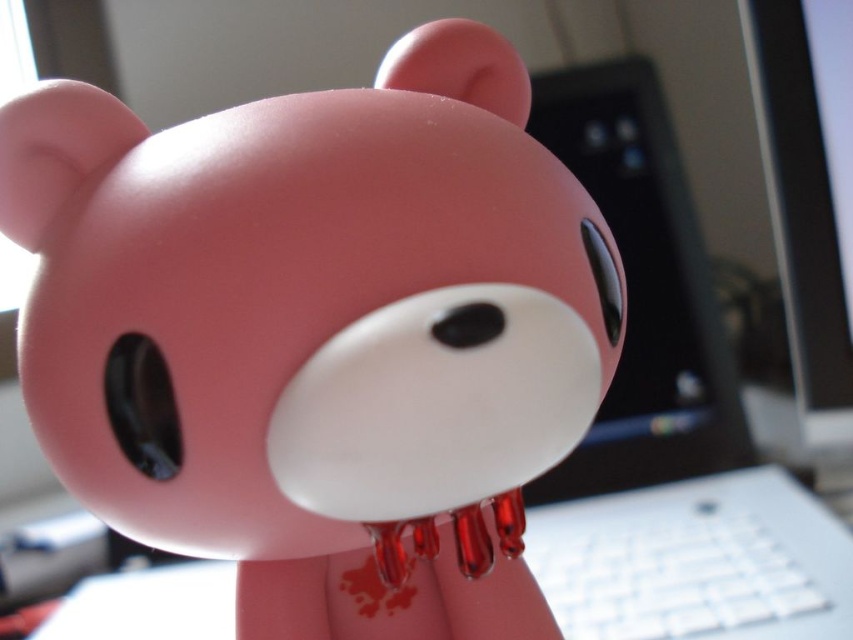
Question: Which point is closer to the camera?

Choices:
 (A) matte pink bear at center
 (B) sleek black laptop at center

Answer: (A)

Question: Can you confirm if matte pink bear at center is wider than sleek black laptop at center?

Choices:
 (A) no
 (B) yes

Answer: (A)

Question: Observing the image, what is the correct spatial positioning of matte pink bear at center in reference to sleek black laptop at center?

Choices:
 (A) below
 (B) above

Answer: (A)

Question: Which point is farther to the camera?

Choices:
 (A) sleek black laptop at center
 (B) matte pink bear at center

Answer: (A)

Question: Can you confirm if matte pink bear at center is wider than sleek black laptop at center?

Choices:
 (A) no
 (B) yes

Answer: (A)

Question: Which point is farther to the camera?

Choices:
 (A) (492, 118)
 (B) (698, 362)

Answer: (B)